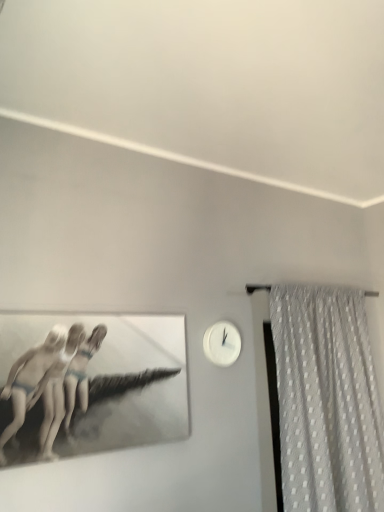
Question: Could you tell me if white glossy clock at upper right is turned towards white dotted fabric at right?

Choices:
 (A) no
 (B) yes

Answer: (A)

Question: Is white glossy clock at upper right shorter than white dotted fabric at right?

Choices:
 (A) yes
 (B) no

Answer: (A)

Question: Considering the relative positions of white glossy clock at upper right and white dotted fabric at right in the image provided, is white glossy clock at upper right to the right of white dotted fabric at right from the viewer's perspective?

Choices:
 (A) no
 (B) yes

Answer: (A)

Question: Can you confirm if white glossy clock at upper right is thinner than white dotted fabric at right?

Choices:
 (A) no
 (B) yes

Answer: (B)

Question: Is white glossy clock at upper right located outside white dotted fabric at right?

Choices:
 (A) yes
 (B) no

Answer: (A)

Question: From a real-world perspective, is white glossy clock at upper right below white dotted fabric at right?

Choices:
 (A) yes
 (B) no

Answer: (B)

Question: Is the position of white dotted fabric at right more distant than that of white glossy clock at upper right?

Choices:
 (A) no
 (B) yes

Answer: (A)

Question: Is white dotted fabric at right directly adjacent to white glossy clock at upper right?

Choices:
 (A) yes
 (B) no

Answer: (B)

Question: Is white dotted fabric at right not near white glossy clock at upper right?

Choices:
 (A) yes
 (B) no

Answer: (B)

Question: Can you confirm if white dotted fabric at right is thinner than white glossy clock at upper right?

Choices:
 (A) yes
 (B) no

Answer: (B)

Question: Is the depth of white dotted fabric at right less than that of white glossy clock at upper right?

Choices:
 (A) no
 (B) yes

Answer: (B)

Question: From a real-world perspective, is white dotted fabric at right on top of white glossy clock at upper right?

Choices:
 (A) no
 (B) yes

Answer: (A)

Question: Considering the relative positions of white dotted fabric at right and white glossy clock at upper right in the image provided, is white dotted fabric at right to the left or to the right of white glossy clock at upper right?

Choices:
 (A) right
 (B) left

Answer: (A)